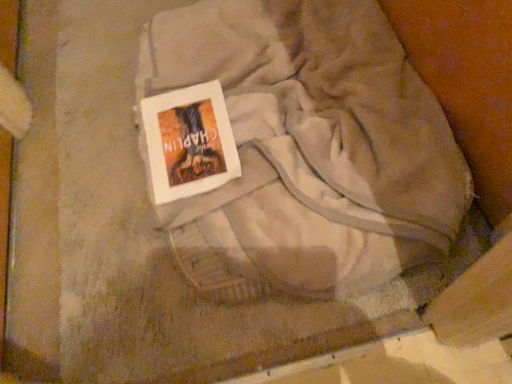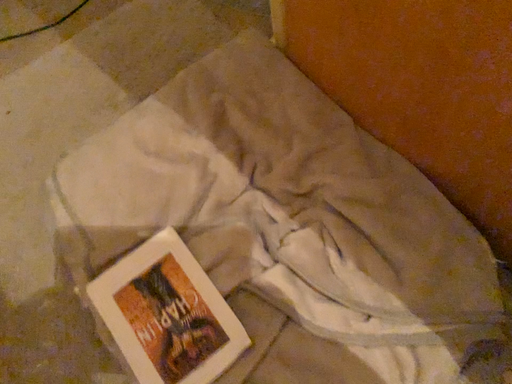
Question: How did the camera likely rotate when shooting the video?

Choices:
 (A) rotated left
 (B) rotated right

Answer: (B)